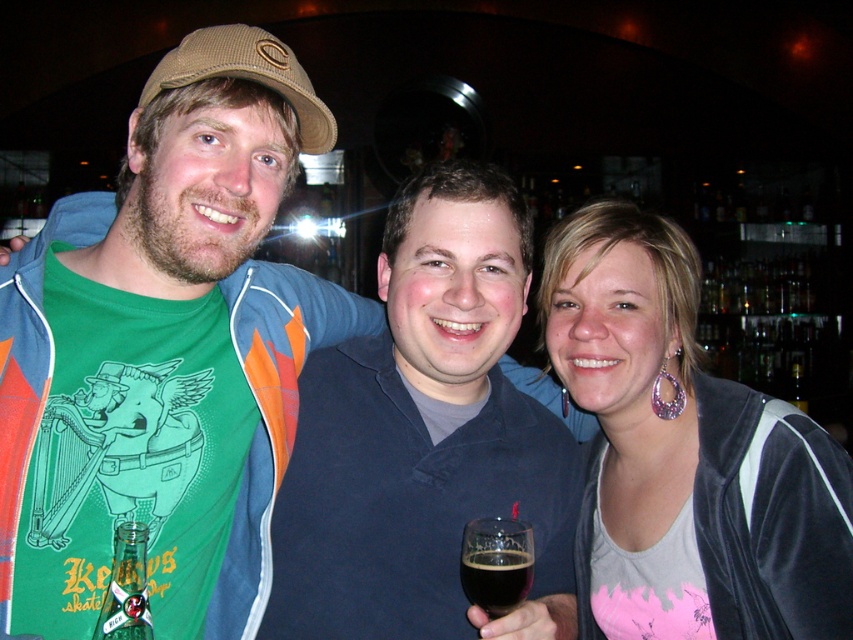
Question: Among these objects, which one is farthest from the camera?

Choices:
 (A) dark glass at center
 (B) tan fabric baseball cap at upper left
 (C) matte black jacket at center
 (D) green fabric shirt at left

Answer: (C)

Question: Which point is farther from the camera taking this photo?

Choices:
 (A) (566, 284)
 (B) (384, 400)
 (C) (195, 45)

Answer: (A)

Question: Is tan fabric baseball cap at upper left closer to the viewer compared to green glass bottle at lower left?

Choices:
 (A) yes
 (B) no

Answer: (B)

Question: Can you confirm if matte black jacket at center is positioned above tan fabric baseball cap at upper left?

Choices:
 (A) yes
 (B) no

Answer: (B)

Question: Does matte black jacket at center appear under green glass bottle at lower left?

Choices:
 (A) yes
 (B) no

Answer: (B)

Question: Which is farther from the dark blue shirt at center?

Choices:
 (A) green glass bottle at lower left
 (B) matte black jacket at center
 (C) dark glass at center

Answer: (A)